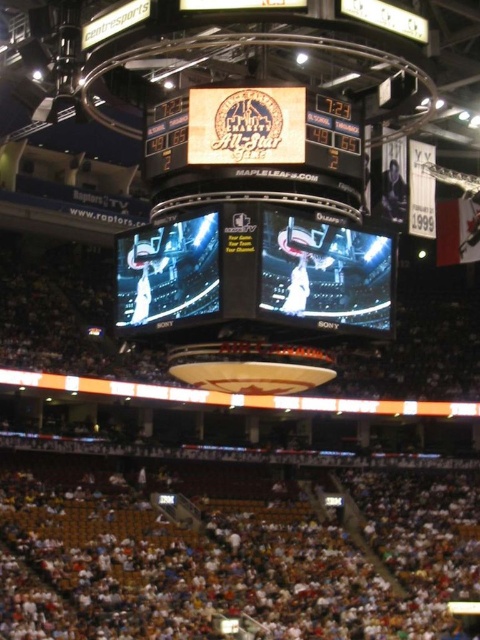
You are a stagehand preparing to hang a new banner. You need to determine which object, the white fabric crowd at lower center or the black glossy scoreboard at center, has a larger physical size to ensure the banner can fit. Based on the scene description, which object is bigger?

The white fabric crowd at lower center is bigger than the black glossy scoreboard at center, so the banner should be placed where the white fabric crowd at lower center is located if it requires more space.

You are a stagehand in the arena and need to move a 150 feet long banner from the white fabric crowd at lower center to the wooden sign at center. Can you fit the banner between them without folding it?

The distance between the white fabric crowd at lower center and the wooden sign at center is 176.96 feet. Since the banner is 150 feet long, it can fit between them without folding as there is enough space.

You are a photographer taking a picture of the central scoreboard and video display system in the arena. To ensure the white fabric crowd at lower center is not blocking the view, where should you position yourself relative to the scoreboard?

To avoid the white fabric crowd at lower center blocking the view of the scoreboard, position yourself to the left or right of the scoreboard since the crowd is located at point (x=232, y=552), which is near the center. Moving to the sides would place the crowd off to one side, keeping the scoreboard clear.